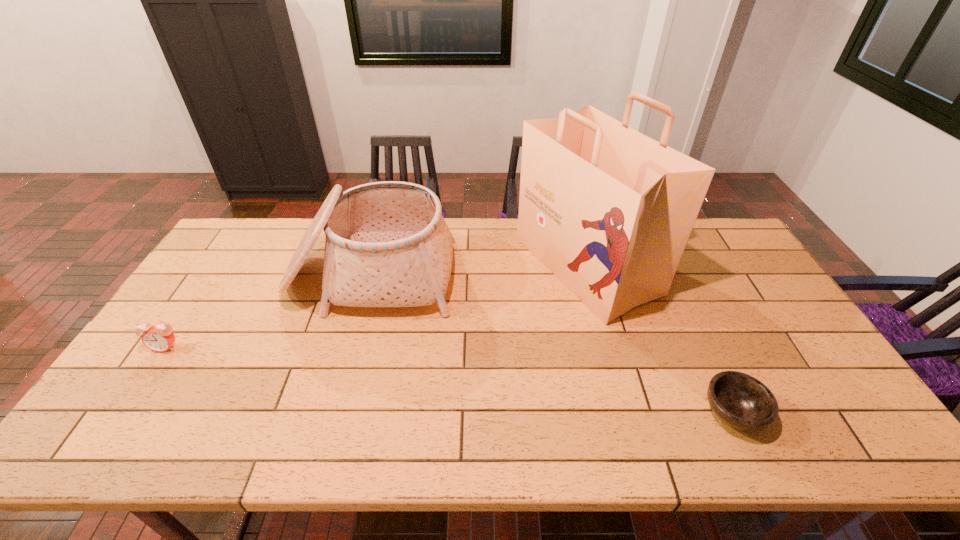
Locate an element on the screen. This screenshot has width=960, height=540. free region at the right edge is located at coordinates (756, 299).

This screenshot has height=540, width=960. In order to click on unoccupied position between the second shortest object and the third shortest object in this screenshot , I will do `click(268, 311)`.

The width and height of the screenshot is (960, 540). Identify the location of vacant space that's between the third shortest object and the grocery bag. (478, 271).

You are a GUI agent. You are given a task and a screenshot of the screen. Output one action in this format:
    pyautogui.click(x=<x>, y=<y>)
    Task: Click on the free space that is in between the nearest object and the second tallest object
    The height and width of the screenshot is (540, 960).
    Given the screenshot: What is the action you would take?
    pyautogui.click(x=551, y=344)

Identify the location of free point between the nearest object and the third tallest object. (449, 380).

This screenshot has height=540, width=960. Find the location of `vacant area that lies between the shortest object and the second object from left to right`. vacant area that lies between the shortest object and the second object from left to right is located at coordinates (551, 344).

Identify the location of free space that is in between the third shortest object and the third tallest object. (268, 311).

Where is `free space between the tallest object and the third object from right to left`? free space between the tallest object and the third object from right to left is located at coordinates (478, 271).

This screenshot has height=540, width=960. In order to click on free space between the bowl and the tallest object in this screenshot , I will do `click(660, 339)`.

Image resolution: width=960 pixels, height=540 pixels. Identify the location of empty space that is in between the alarm clock and the nearest object. (449, 380).